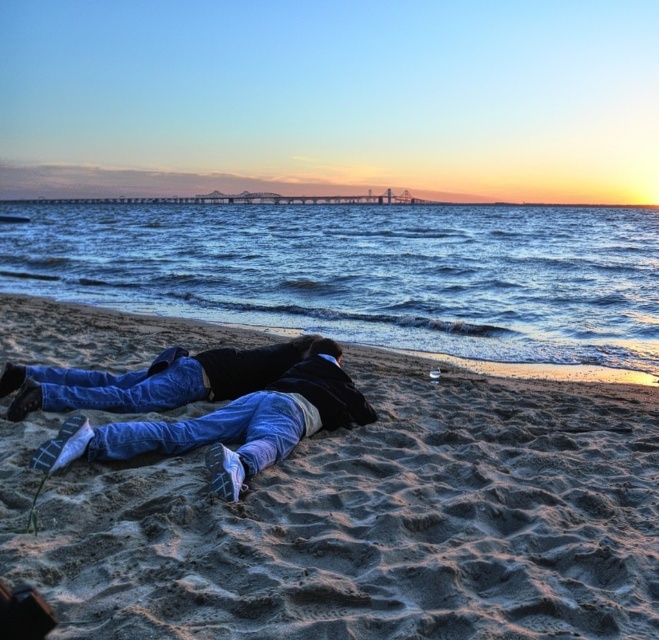
Question: Considering the real-world distances, which object is closest to the blue jeans at lower center?

Choices:
 (A) sandy beach at lower center
 (B) denim jeans at center

Answer: (B)

Question: Can you confirm if blue water at center is thinner than denim jeans at center?

Choices:
 (A) yes
 (B) no

Answer: (B)

Question: Can you confirm if denim jeans at center is positioned below blue jeans at lower center?

Choices:
 (A) yes
 (B) no

Answer: (A)

Question: Which object is positioned closest to the blue water at center?

Choices:
 (A) sandy beach at lower center
 (B) blue jeans at lower center
 (C) denim jeans at center

Answer: (C)

Question: Which of the following is the closest to the observer?

Choices:
 (A) sandy beach at lower center
 (B) blue jeans at lower center

Answer: (A)

Question: Does blue water at center appear under blue jeans at lower center?

Choices:
 (A) yes
 (B) no

Answer: (B)